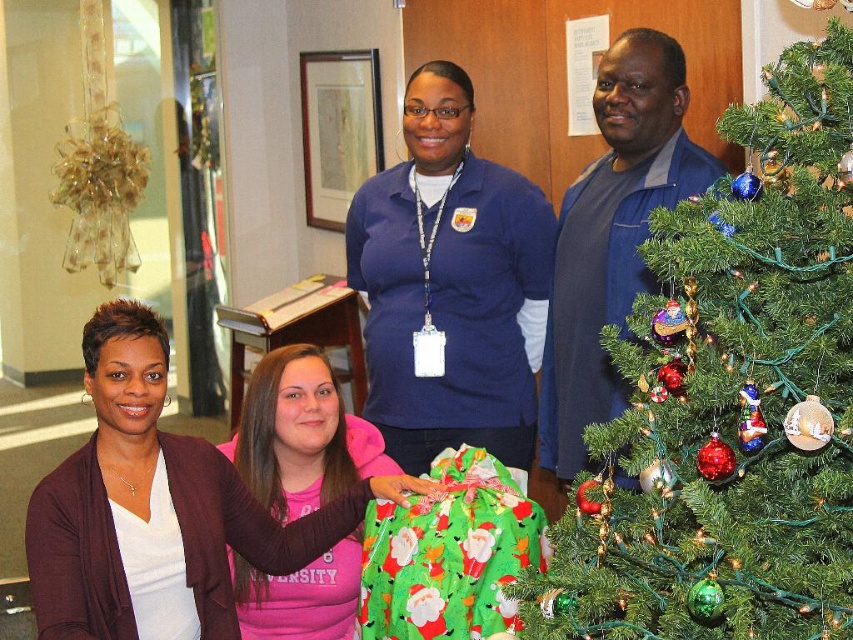
You are a photographer setting up for a group photo. You notice two people wearing the matte blue shirt at center and the matte white shirt at center. The camera you are using has a minimum focus distance of 28 inches. Can you focus on both subjects simultaneously without adjusting your position?

The matte blue shirt at center and matte white shirt at center are 28.34 inches apart from each other. Since the distance between them is slightly over the camera minimum focus distance of 28 inches, the camera can focus on both subjects simultaneously without needing to adjust your position.